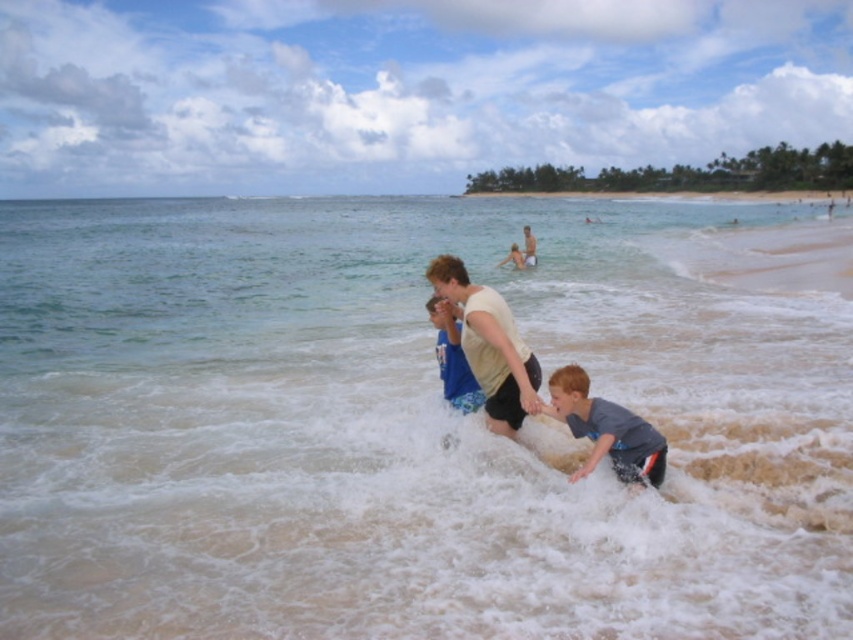
Looking at this image, can you confirm if clear water at center is positioned below light beige cotton shirt at center?

No.

Locate an element on the screen. clear water at center is located at coordinates (405, 426).

Does point (325, 369) lie in front of point (498, 404)?

That is False.

Where is `clear water at center`? clear water at center is located at coordinates (405, 426).

Does clear water at center have a greater height compared to light blue fabric shirt at center?

Indeed, clear water at center has a greater height compared to light blue fabric shirt at center.

Is clear water at center thinner than light blue fabric shirt at center?

Incorrect, clear water at center's width is not less than light blue fabric shirt at center's.

Who is more forward, [593,573] or [534,244]?

Point [593,573] is more forward.

Where is `clear water at center`? clear water at center is located at coordinates (405, 426).

Can you confirm if clear water at center is taller than gray matte shirt at lower right?

Correct, clear water at center is much taller as gray matte shirt at lower right.

Is clear water at center smaller than gray matte shirt at lower right?

No.

Is point (393, 481) farther from viewer compared to point (589, 410)?

Yes, it is.

Image resolution: width=853 pixels, height=640 pixels. In order to click on clear water at center in this screenshot , I will do `click(405, 426)`.